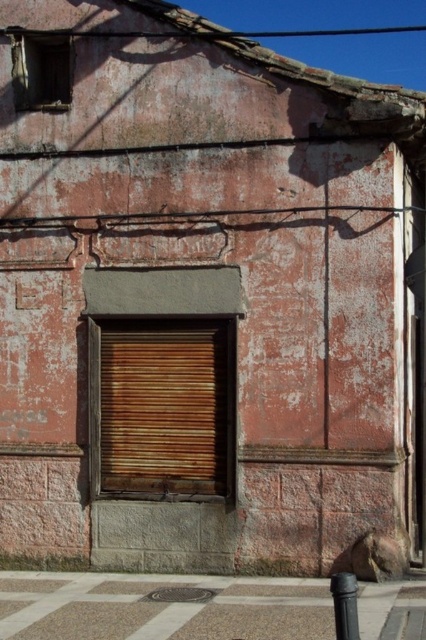
Question: Which of the following is the farthest from the observer?

Choices:
 (A) (333, 600)
 (B) (157, 433)

Answer: (B)

Question: Is the position of rusty wood shutter at center more distant than that of black matte pole at lower right?

Choices:
 (A) no
 (B) yes

Answer: (B)

Question: Is rusty wood shutter at center closer to the viewer compared to black matte pole at lower right?

Choices:
 (A) no
 (B) yes

Answer: (A)

Question: Does rusty wood shutter at center have a lesser width compared to black matte pole at lower right?

Choices:
 (A) yes
 (B) no

Answer: (B)